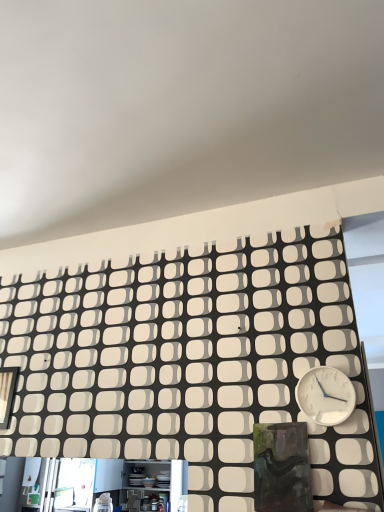
The width and height of the screenshot is (384, 512). Find the location of `white plastic wall clock at right`. white plastic wall clock at right is located at coordinates (326, 395).

Describe the element at coordinates (326, 395) in the screenshot. I see `white plastic wall clock at right` at that location.

The image size is (384, 512). Describe the element at coordinates (7, 393) in the screenshot. I see `matte black frame at left` at that location.

You are a GUI agent. You are given a task and a screenshot of the screen. Output one action in this format:
    pyautogui.click(x=<x>, y=<y>)
    Task: Click on the matte black frame at left
    Image resolution: width=384 pixels, height=512 pixels.
    Given the screenshot: What is the action you would take?
    pyautogui.click(x=7, y=393)

Where is `white plastic wall clock at right`? white plastic wall clock at right is located at coordinates (326, 395).

Between matte black frame at left and white plastic wall clock at right, which one appears on the left side from the viewer's perspective?

Positioned to the left is matte black frame at left.

Between matte black frame at left and white plastic wall clock at right, which one is positioned behind?

matte black frame at left.

Which point is more distant from viewer, (2, 428) or (336, 407)?

Positioned behind is point (2, 428).

From the image's perspective, is matte black frame at left above white plastic wall clock at right?

No, from the image's perspective, matte black frame at left is not on top of white plastic wall clock at right.

From a real-world perspective, which is physically above, matte black frame at left or white plastic wall clock at right?

matte black frame at left is physically above.

Which of these two, matte black frame at left or white plastic wall clock at right, is thinner?

matte black frame at left.

Is matte black frame at left taller or shorter than white plastic wall clock at right?

In the image, matte black frame at left appears to be taller than white plastic wall clock at right.

Looking at the image, does matte black frame at left seem bigger or smaller compared to white plastic wall clock at right?

Considering their sizes, matte black frame at left takes up less space than white plastic wall clock at right.

Consider the image. Is matte black frame at left outside of white plastic wall clock at right?

Yes, matte black frame at left is outside of white plastic wall clock at right.

Would you consider matte black frame at left to be distant from white plastic wall clock at right?

Yes, matte black frame at left is far from white plastic wall clock at right.

Is matte black frame at left facing towards white plastic wall clock at right?

No, matte black frame at left is not aimed at white plastic wall clock at right.

Measure the distance from matte black frame at left to white plastic wall clock at right.

matte black frame at left is 1.37 meters from white plastic wall clock at right.

Find the location of a particular element. window that appears above the white plastic wall clock at right (from a real-world perspective) is located at coordinates (7, 393).

Considering the relative positions of white plastic wall clock at right and matte black frame at left in the image provided, is white plastic wall clock at right to the left of matte black frame at left from the viewer's perspective?

Incorrect, white plastic wall clock at right is not on the left side of matte black frame at left.

Does white plastic wall clock at right lie behind matte black frame at left?

That is False.

Is point (339, 396) positioned behind point (8, 415)?

No, it is in front of (8, 415).

From the image's perspective, is white plastic wall clock at right under matte black frame at left?

No, from the image's perspective, white plastic wall clock at right is not beneath matte black frame at left.

From a real-world perspective, between white plastic wall clock at right and matte black frame at left, who is vertically lower?

white plastic wall clock at right is physically lower.

Consider the image. Does white plastic wall clock at right have a greater width compared to matte black frame at left?

Correct, the width of white plastic wall clock at right exceeds that of matte black frame at left.

Considering the sizes of white plastic wall clock at right and matte black frame at left in the image, is white plastic wall clock at right taller or shorter than matte black frame at left?

Clearly, white plastic wall clock at right is shorter compared to matte black frame at left.

Which of these two, white plastic wall clock at right or matte black frame at left, is bigger?

With larger size is white plastic wall clock at right.

Based on the photo, is white plastic wall clock at right situated inside matte black frame at left or outside?

white plastic wall clock at right exists outside the volume of matte black frame at left.

Is white plastic wall clock at right touching matte black frame at left?

There is a gap between white plastic wall clock at right and matte black frame at left.

Could you tell me if white plastic wall clock at right is turned towards matte black frame at left?

No, white plastic wall clock at right does not turn towards matte black frame at left.

How different are the orientations of white plastic wall clock at right and matte black frame at left in degrees?

The facing directions of white plastic wall clock at right and matte black frame at left are 0.874 degrees apart.

At what (x,y) coordinates should I click in order to perform the action: click on wall clock located above the matte black frame at left (from the image's perspective). Please return your answer as a coordinate pair (x, y). The height and width of the screenshot is (512, 384). Looking at the image, I should click on (326, 395).

This screenshot has width=384, height=512. Identify the location of window located on the left of white plastic wall clock at right. (7, 393).

This screenshot has height=512, width=384. What are the coordinates of `wall clock above the matte black frame at left (from the image's perspective)` in the screenshot? It's located at (326, 395).